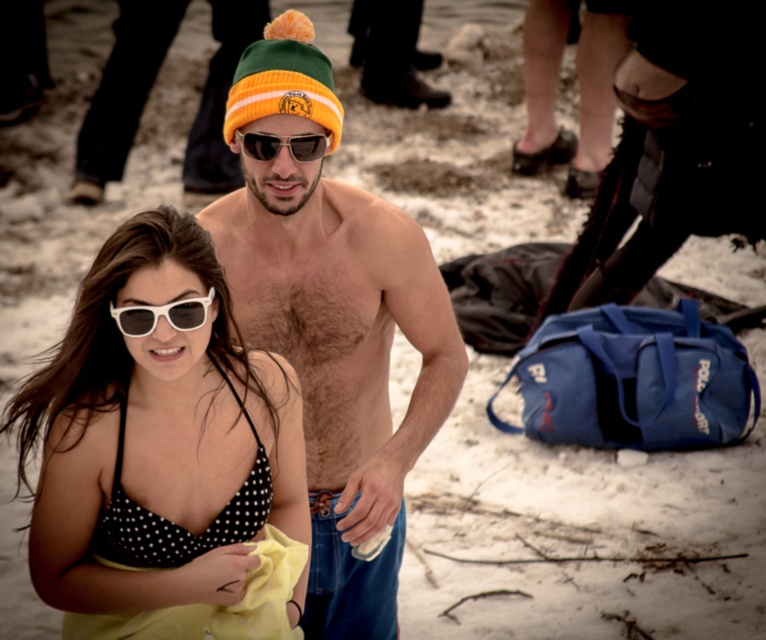
Question: From the image, what is the correct spatial relationship of yellow fabric at lower left in relation to black polka dot bikini top at lower left?

Choices:
 (A) below
 (B) above

Answer: (A)

Question: Which point appears farthest from the camera in this image?

Choices:
 (A) (421, 436)
 (B) (198, 637)

Answer: (A)

Question: Can you confirm if black polka dot bikini top at lower left is positioned below matte black sunglasses at center?

Choices:
 (A) no
 (B) yes

Answer: (B)

Question: Estimate the real-world distances between objects in this image. Which object is closer to the green/yellow knit beanie at center?

Choices:
 (A) shiny orange knit beanie at center
 (B) white plastic sunglasses at center

Answer: (A)

Question: Does yellow fabric at lower left appear on the right side of matte black sunglasses at center?

Choices:
 (A) yes
 (B) no

Answer: (B)

Question: Among these points, which one is nearest to the camera?

Choices:
 (A) (303, 148)
 (B) (231, 134)
 (C) (149, 566)

Answer: (C)